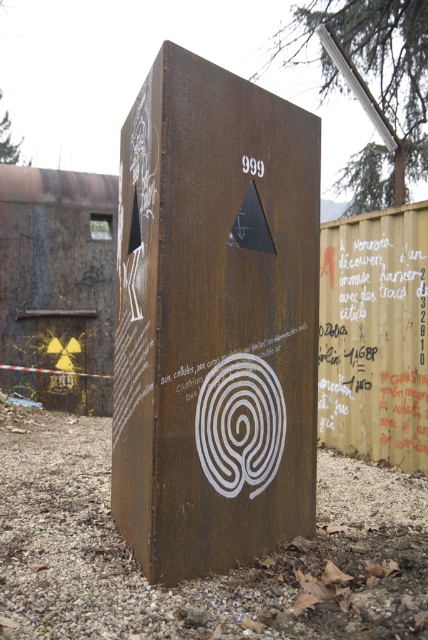
You are a maintenance worker needing to reach both the rusty metal box at center and the red painted text at right. If your ladder is 3 meters long, can you safely reach both objects without moving the ladder?

The rusty metal box at center is 2.65 meters away from the red painted text at right. Since the ladder is 3 meters long, it can safely reach both objects as the distance between them is within the ladder length.

Based on the photo, you are standing in front of a large rusty metal structure. You notice a point marked at coordinates (214, 321). Where exactly is this point located on the structure?

The point at coordinates (214, 321) is located on the rusty metal box at center.

You are an inspector checking the structure. You need to determine if the height of the rusty metal box at center allows the red painted text at right to be visible from the ground level. Can you confirm this?

The rusty metal box at center is much taller than the red painted text at right, so the red painted text at right may not be visible from the ground level because it is shorter.